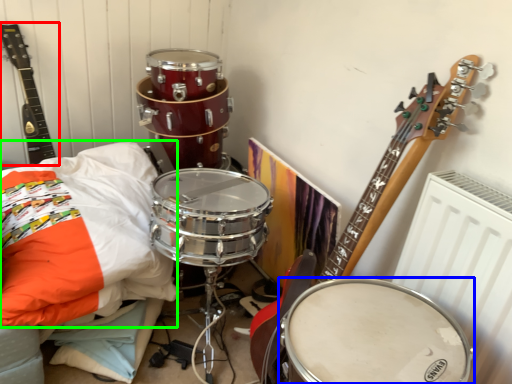
Question: Estimate the real-world distances between objects in this image. Which object is closer to guitar (highlighted by a red box), drum (highlighted by a blue box) or pillow (highlighted by a green box)?

Choices:
 (A) drum
 (B) pillow

Answer: (B)